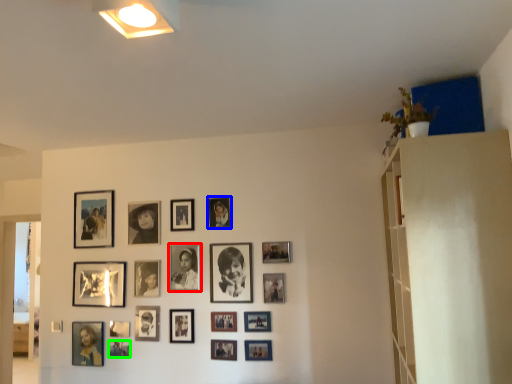
Question: Which object is the farthest from picture frame (highlighted by a red box)? Choose among these: picture frame (highlighted by a blue box) or picture frame (highlighted by a green box).

Choices:
 (A) picture frame
 (B) picture frame

Answer: (B)